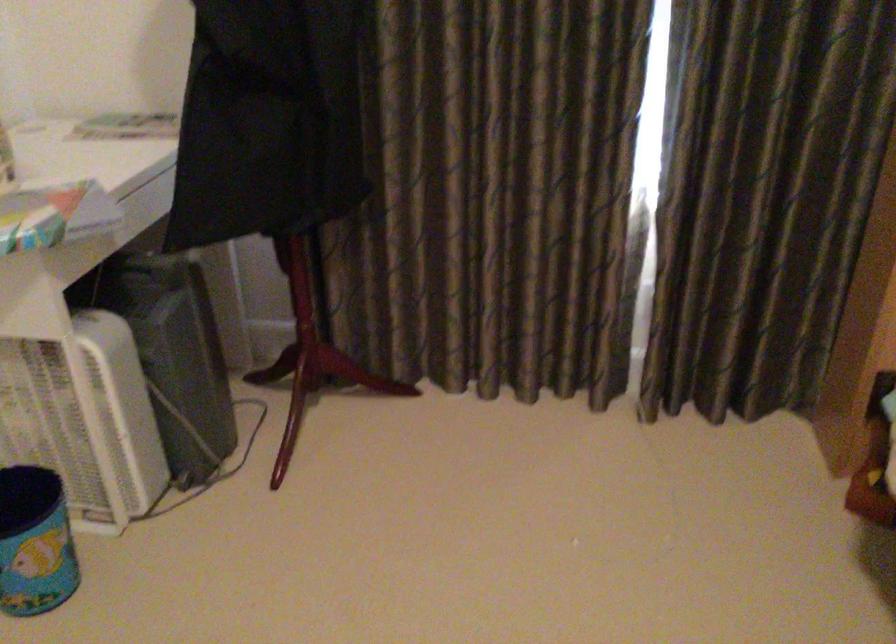
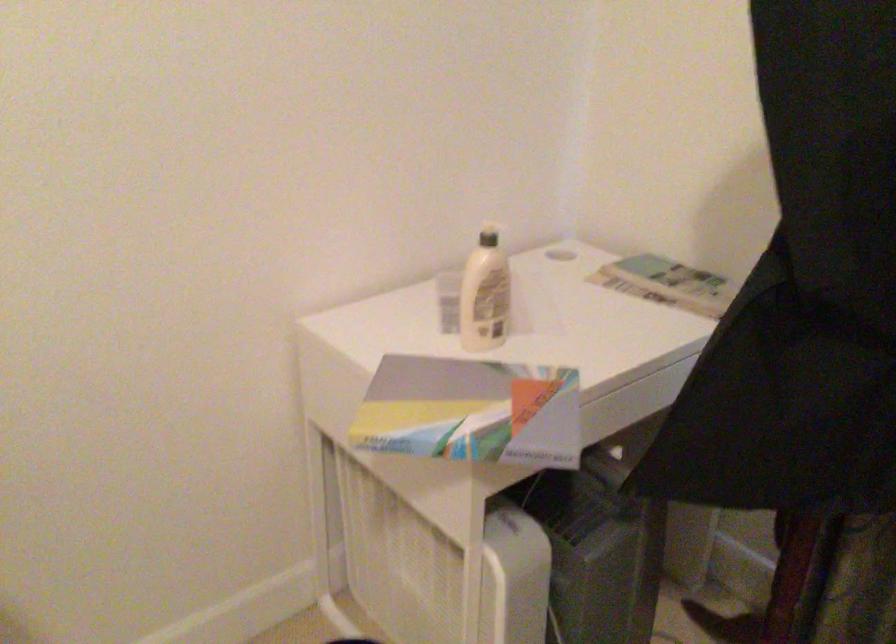
Question: The camera is either moving clockwise (left) or counter-clockwise (right) around the object. The first image is from the beginning of the video and the second image is from the end. Is the camera moving left or right when shooting the video?

Choices:
 (A) Left
 (B) Right

Answer: (B)